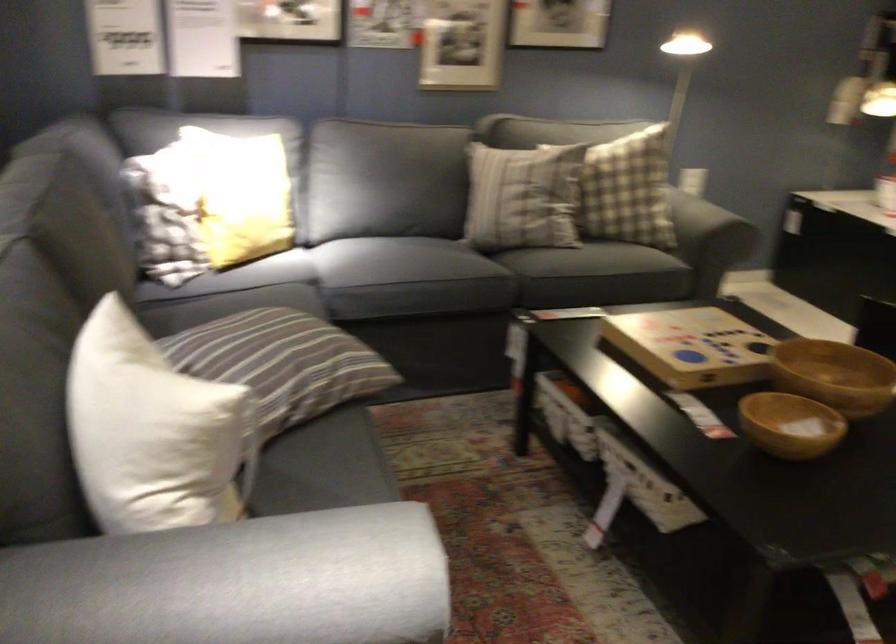
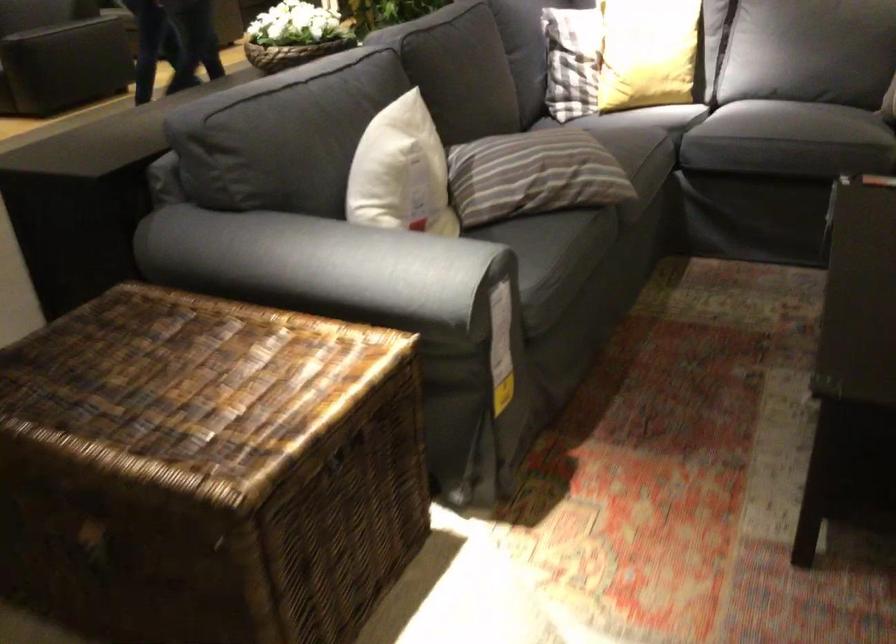
Question: The first image is from the beginning of the video and the second image is from the end. How did the camera likely rotate when shooting the video?

Choices:
 (A) Left
 (B) Right
 (C) Up
 (D) Down

Answer: (A)